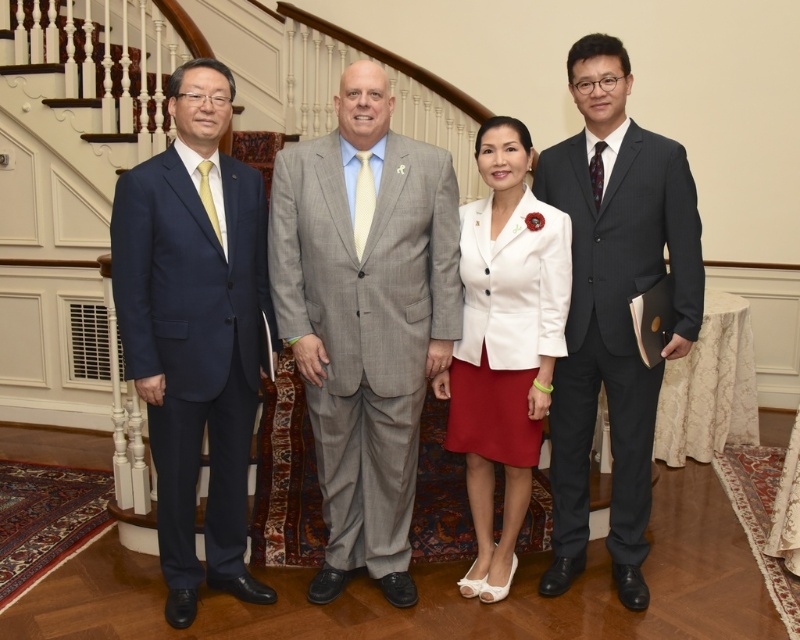
You are organizing a photo shoot and need to ensure that the two central outfits in the image, the matte black suit at center and the white matte blazer at center, are displayed properly. Based on their sizes, which outfit would require more space when arranging them side by side?

The matte black suit at center requires more space when arranged side by side with the white matte blazer at center because its width is larger than the white matte blazer at center.

You are organizing a photo shoot and need to arrange two suits for a display. The gray textured suit at center and the matte blue suit at left are available. Based on the image, which suit should be placed on the right side of the display to ensure proper alignment with their original positions in the group photo?

The gray textured suit at center should be placed on the right side of the display because in the original image, the gray textured suit at center is positioned to the right of the matte blue suit at left, and since it might be wider, it would maintain the spatial relationship.